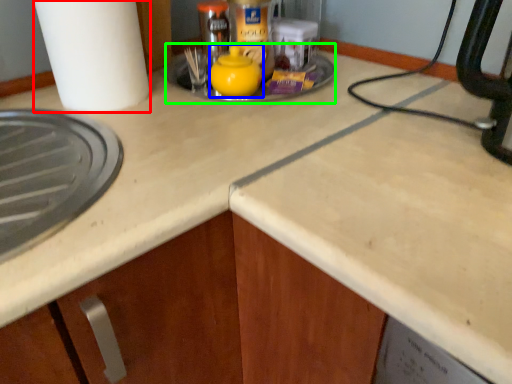
Question: Based on their relative distances, which object is nearer to paper towel (highlighted by a red box)? Choose from tea pot (highlighted by a blue box) and sink (highlighted by a green box).

Choices:
 (A) tea pot
 (B) sink

Answer: (B)